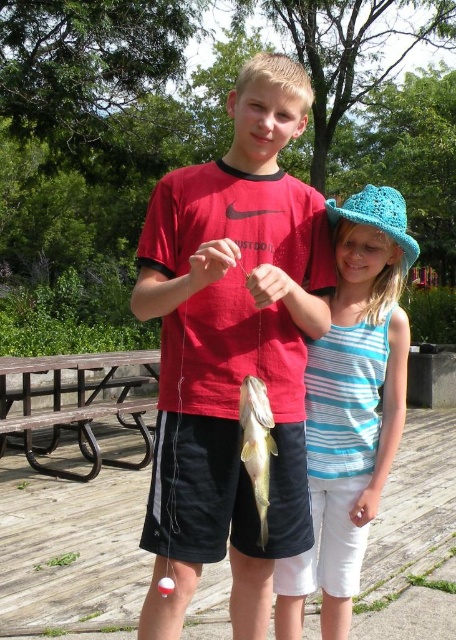
You are a photographer standing in front of the two children. You want to take a photo that focuses on the matte red shirt at center and the blue striped tank top at center. Which child should you move closer to the camera to ensure both shirts are in focus?

You should move the blue striped tank top at center closer to the camera because the matte red shirt at center is already closer to the viewer. This will balance their distances so both shirts are in focus.

You are standing at the point with coordinates (x=76, y=404) in the image. What object are you standing on?

You are standing on the brown wooden picnic table at lower left.

You are a photographer trying to capture a photo of the blue striped tank top at center and the brown wooden picnic table at lower left. Which object should you focus on first if you want to include both in the frame without moving the camera?

The blue striped tank top at center is smaller than the brown wooden picnic table at lower left, so you should focus on the brown wooden picnic table at lower left first to ensure it fits in the frame.